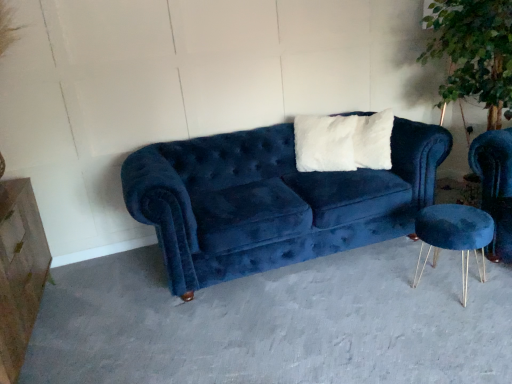
At what (x,y) coordinates should I click in order to perform the action: click on free spot to the left of velvet blue stool at lower right. Please return your answer as a coordinate pair (x, y). The width and height of the screenshot is (512, 384). Looking at the image, I should click on tap(390, 285).